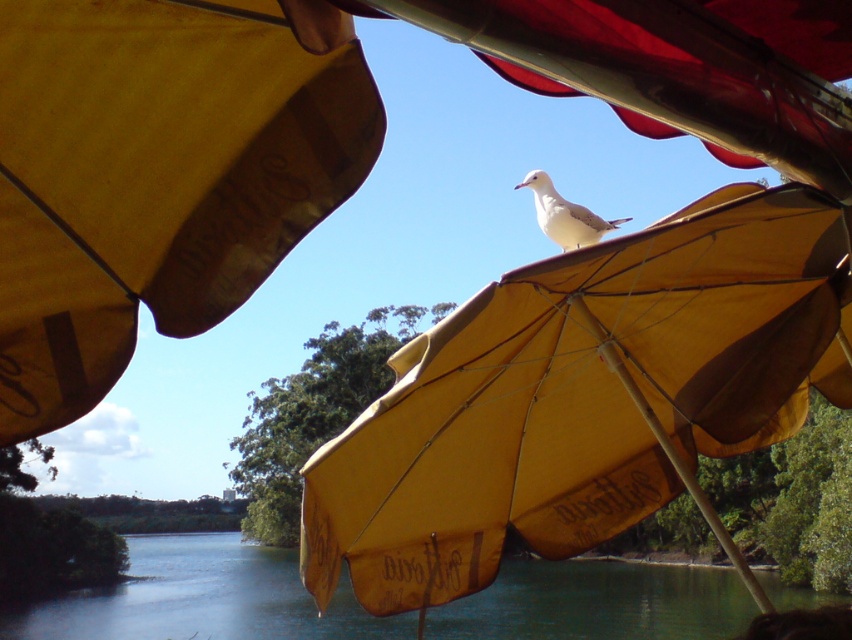
Which of these two, yellow matte umbrella at upper center or white matte bird at center, stands shorter?

With less height is white matte bird at center.

Which is in front, point (98, 84) or point (590, 241)?

Point (98, 84) is more forward.

Locate an element on the screen. yellow matte umbrella at upper center is located at coordinates (315, 141).

Can you confirm if yellow fabric umbrella at center is shorter than white matte bird at center?

No, yellow fabric umbrella at center is not shorter than white matte bird at center.

Is yellow fabric umbrella at center above white matte bird at center?

Incorrect, yellow fabric umbrella at center is not positioned above white matte bird at center.

What are the coordinates of `yellow fabric umbrella at center` in the screenshot? It's located at (583, 397).

Based on the photo, is transparent blue water at lower center further to camera compared to white matte bird at center?

No, transparent blue water at lower center is in front of white matte bird at center.

Which is more to the right, transparent blue water at lower center or white matte bird at center?

Positioned to the right is white matte bird at center.

Between point (157, 624) and point (563, 252), which one is positioned in front?

Point (563, 252) is in front.

Locate an element on the screen. The image size is (852, 640). transparent blue water at lower center is located at coordinates (203, 598).